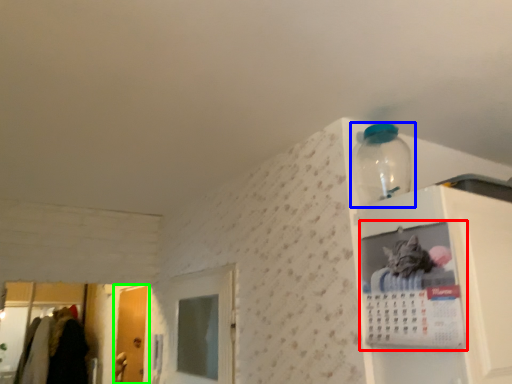
Question: Which object is positioned farthest from cabinet (highlighted by a red box)? Select from bottle (highlighted by a blue box) and door (highlighted by a green box).

Choices:
 (A) bottle
 (B) door

Answer: (B)